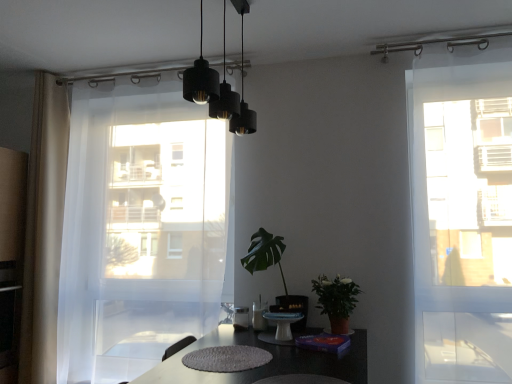
Locate an element on the screen. The width and height of the screenshot is (512, 384). blank space situated above white sheer curtain at left, which is counted as the first curtain, starting from the left (from a real-world perspective) is located at coordinates (49, 74).